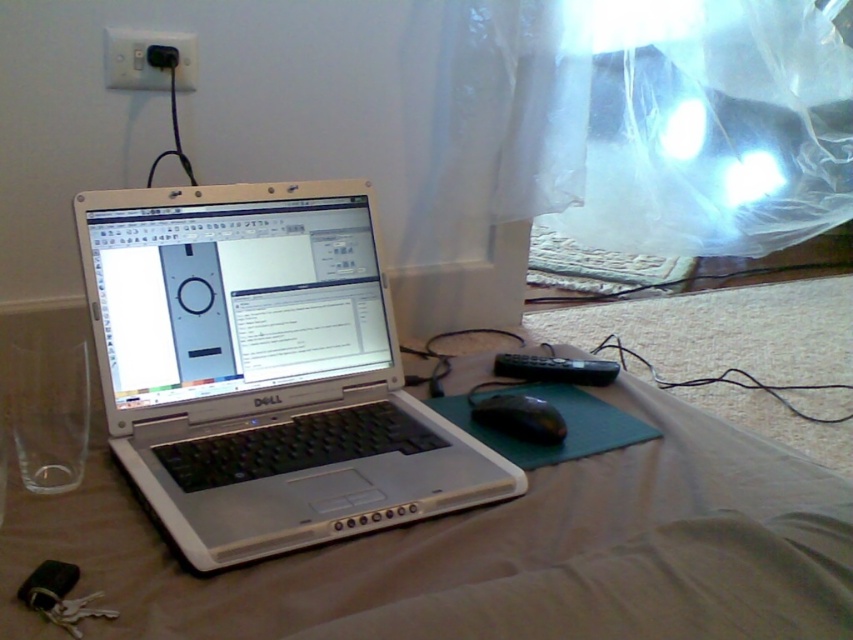
Can you confirm if silver metallic laptop at center is positioned above black plastic mouse at lower center?

Yes.

Can you confirm if silver metallic laptop at center is positioned to the right of black plastic mouse at lower center?

In fact, silver metallic laptop at center is to the left of black plastic mouse at lower center.

Which is behind, point (155, 400) or point (538, 406)?

The point (538, 406) is more distant.

Where is `silver metallic laptop at center`? The width and height of the screenshot is (853, 640). silver metallic laptop at center is located at coordinates (263, 371).

Is point (105, 56) less distant than point (480, 406)?

No, it is not.

Between black plastic plug at upper left and black plastic mouse at lower center, which one is positioned higher?

black plastic plug at upper left is above.

This screenshot has width=853, height=640. I want to click on black plastic plug at upper left, so click(148, 60).

Between point (267, 509) and point (132, 58), which one is positioned in front?

Point (267, 509)

From the picture: Is silver metallic laptop at center thinner than black plastic plug at upper left?

No, silver metallic laptop at center is not thinner than black plastic plug at upper left.

Describe the element at coordinates (263, 371) in the screenshot. I see `silver metallic laptop at center` at that location.

Where is `silver metallic laptop at center`? The image size is (853, 640). silver metallic laptop at center is located at coordinates pyautogui.click(x=263, y=371).